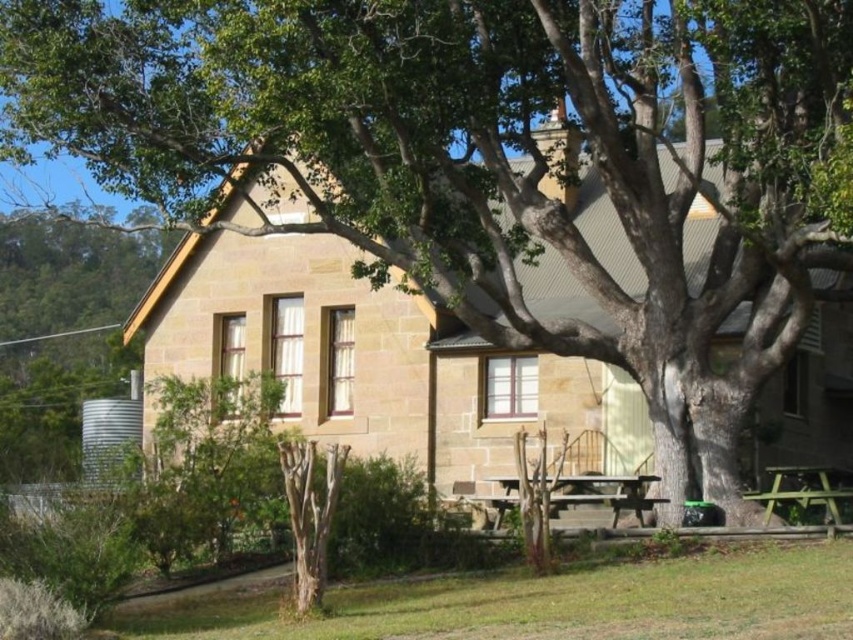
Question: Does wooden picnic table at center lie behind green wooden picnic table at lower right?

Choices:
 (A) yes
 (B) no

Answer: (A)

Question: Which point is closer to the camera taking this photo?

Choices:
 (A) (593, 483)
 (B) (825, 467)

Answer: (B)

Question: Does wooden picnic table at center have a lesser width compared to green wooden picnic table at lower right?

Choices:
 (A) no
 (B) yes

Answer: (A)

Question: Can you confirm if wooden picnic table at center is positioned to the right of green wooden picnic table at lower right?

Choices:
 (A) yes
 (B) no

Answer: (B)